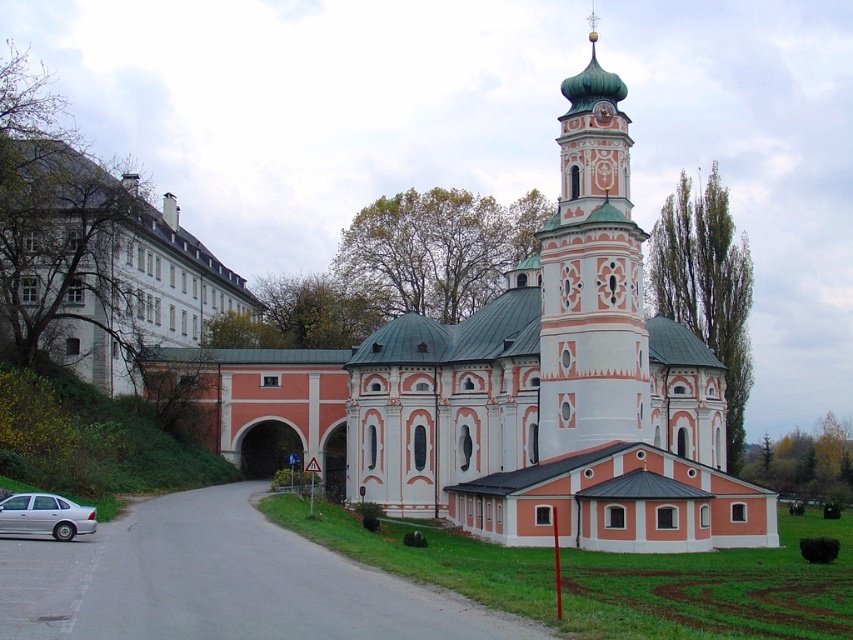
You are a tourist standing in front of the historic building complex. You notice the light blue painted stone tower at center right and the silver metallic car at lower left. Which object is closer to you?

The light blue painted stone tower at center right is closer to you because the silver metallic car at lower left is behind it.

Based on the photo, you are standing in front of the historic building complex. You see a light blue painted stone tower at center right and a silver metallic car at lower left. Which object is wider?

The light blue painted stone tower at center right might be wider than silver metallic car at lower left.